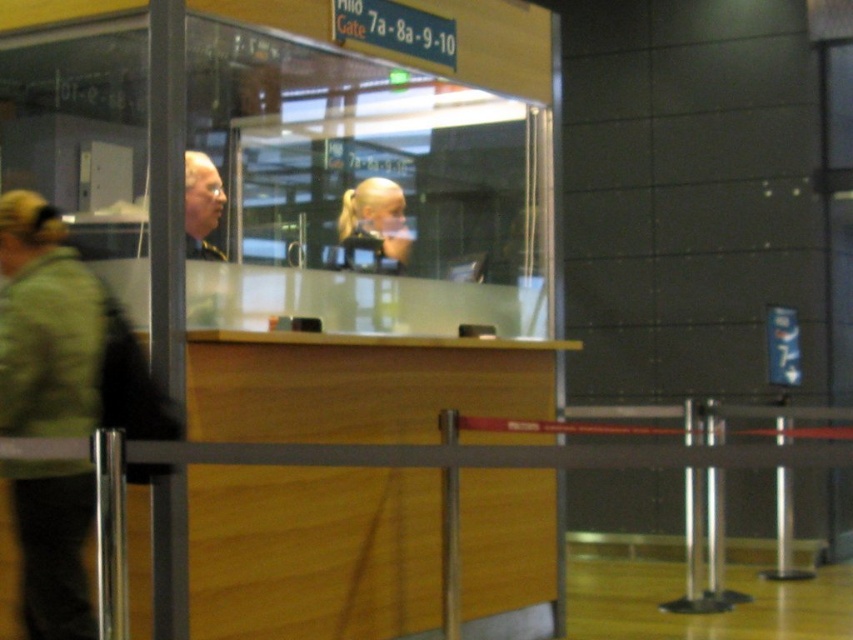
Does point (244, 340) lie behind point (358, 244)?

That is False.

Is light brown wood desk at center taller than blonde hair ponytail at center?

Yes, light brown wood desk at center is taller than blonde hair ponytail at center.

Which is behind, point (265, 532) or point (380, 227)?

The point (380, 227) is more distant.

This screenshot has height=640, width=853. I want to click on light brown wood desk at center, so click(x=312, y=552).

Can you confirm if green fabric jacket at left is thinner than matte black hair at center?

In fact, green fabric jacket at left might be wider than matte black hair at center.

Is point (30, 502) in front of point (196, 179)?

Yes, point (30, 502) is closer to viewer.

Identify the location of green fabric jacket at left. The image size is (853, 640). (45, 324).

Can you confirm if blonde hair ponytail at center is positioned to the left of matte black hair at center?

In fact, blonde hair ponytail at center is to the right of matte black hair at center.

Does point (364, 198) come behind point (210, 221)?

Yes, it is.

Where is `blonde hair ponytail at center`? blonde hair ponytail at center is located at coordinates (374, 224).